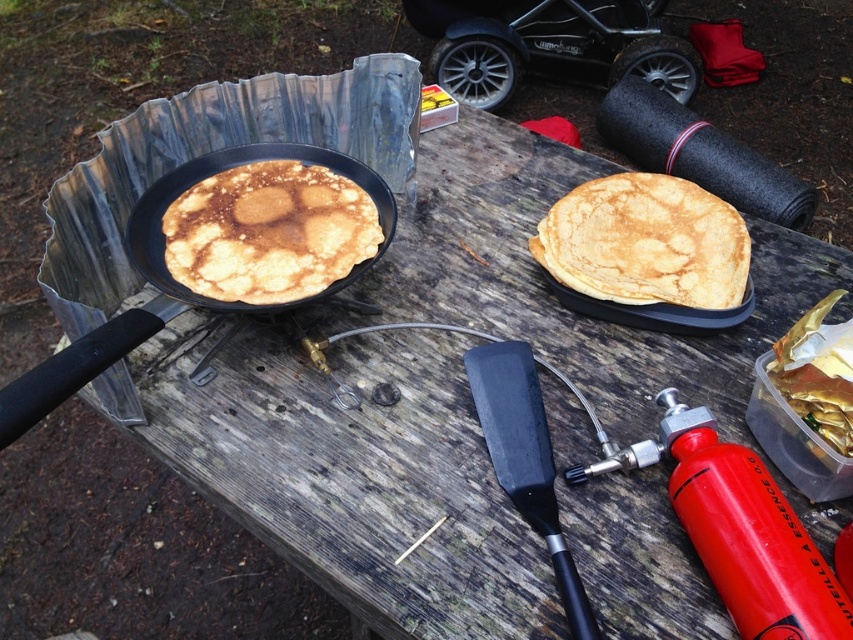
You are a parent at the campsite and need to place a small camping stool between the black rubber baby carriage at upper center and the matte black frying pan at left. Considering their heights, will the stool be more stable if placed closer to the frying pan or the baby carriage?

The black rubber baby carriage at upper center is taller than the matte black frying pan at left. Placing the stool closer to the taller object, the black rubber baby carriage at upper center, would provide a more stable base since it offers a higher anchor point.

You are a camper who wants to take a photo of the golden matte pancake at left. Where exactly should you point your camera to capture it?

The golden matte pancake at left is located at point (270, 232), so you should point your camera there to capture it.

You are standing at the picnic table where the pancake is cooking. You want to reach the point at coordinates point (331,182) to grab a spatula. If your arm can extend 1.1 meters, can you comfortably reach that point?

The point (331,182) is 1.08 meters from the viewer. Since your arm can extend 1.1 meters, you can comfortably reach it.